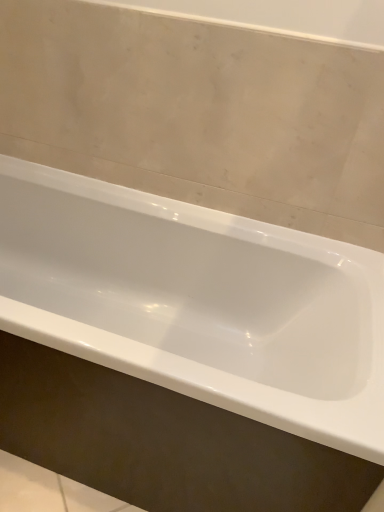
Where is `white glossy bathtub at center`? The width and height of the screenshot is (384, 512). white glossy bathtub at center is located at coordinates (198, 302).

Image resolution: width=384 pixels, height=512 pixels. Describe the element at coordinates (198, 302) in the screenshot. I see `white glossy bathtub at center` at that location.

What are the coordinates of `white glossy bathtub at center` in the screenshot? It's located at (198, 302).